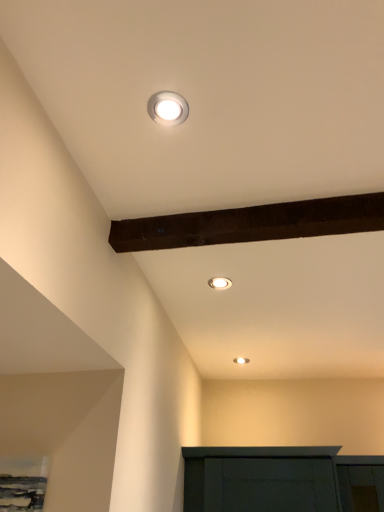
Question: From a real-world perspective, is matte white recessed light at center, arranged as the second lamp when viewed from the top, on white glossy light fixture at upper center, the third lamp viewed from the top?

Choices:
 (A) no
 (B) yes

Answer: (B)

Question: Is matte white recessed light at center, which is the second lamp from back to front, bigger than white glossy light fixture at upper center, the third lamp viewed from the top?

Choices:
 (A) no
 (B) yes

Answer: (A)

Question: Is matte white recessed light at center, placed as the second lamp when sorted from front to back, at the right side of white glossy light fixture at upper center, the third lamp viewed from the top?

Choices:
 (A) no
 (B) yes

Answer: (A)

Question: Does matte white recessed light at center, placed as the second lamp when sorted from front to back, have a smaller size compared to white glossy light fixture at upper center, the third lamp viewed from the top?

Choices:
 (A) no
 (B) yes

Answer: (B)

Question: Is matte white recessed light at center, arranged as the second lamp when viewed from the top, further to the viewer compared to white glossy light fixture at upper center, the 1th lamp positioned from the right?

Choices:
 (A) no
 (B) yes

Answer: (A)

Question: Does point (216, 288) appear closer or farther from the camera than point (243, 364)?

Choices:
 (A) farther
 (B) closer

Answer: (B)

Question: From a real-world perspective, is matte white recessed light at center, arranged as the second lamp when viewed from the top, physically located above or below white glossy light fixture at upper center, which appears as the 1th lamp when ordered from the bottom?

Choices:
 (A) below
 (B) above

Answer: (B)

Question: Choose the correct answer: Is matte white recessed light at center, which is the second lamp from back to front, inside white glossy light fixture at upper center, the 1th lamp positioned from the right, or outside it?

Choices:
 (A) inside
 (B) outside

Answer: (B)

Question: Looking at the image, does matte white recessed light at center, the 2th lamp viewed from the right, seem bigger or smaller compared to white glossy light fixture at upper center, which appears as the 1th lamp when ordered from the bottom?

Choices:
 (A) big
 (B) small

Answer: (B)

Question: Is white glossy light fixture at upper center, the 1th lamp viewed from the back, to the left or to the right of white glossy light fixture at upper center, which is the first lamp in top-to-bottom order, in the image?

Choices:
 (A) right
 (B) left

Answer: (A)

Question: Considering the positions of white glossy light fixture at upper center, the 1th lamp positioned from the right, and white glossy light fixture at upper center, placed as the third lamp when sorted from bottom to top, in the image, is white glossy light fixture at upper center, the 1th lamp positioned from the right, taller or shorter than white glossy light fixture at upper center, placed as the third lamp when sorted from bottom to top,?

Choices:
 (A) tall
 (B) short

Answer: (A)

Question: Looking at their shapes, would you say white glossy light fixture at upper center, which is the 3th lamp in left-to-right order, is wider or thinner than white glossy light fixture at upper center, placed as the third lamp when sorted from bottom to top?

Choices:
 (A) thin
 (B) wide

Answer: (A)

Question: From a real-world perspective, is white glossy light fixture at upper center, the third lamp viewed from the top, positioned above or below white glossy light fixture at upper center, acting as the first lamp starting from the left?

Choices:
 (A) below
 (B) above

Answer: (B)

Question: Is white glossy light fixture at upper center, which appears as the 1th lamp when ordered from the bottom, taller or shorter than matte white recessed light at center, the second lamp viewed from the left?

Choices:
 (A) short
 (B) tall

Answer: (B)

Question: In the image, is white glossy light fixture at upper center, the 1th lamp viewed from the back, on the left side or the right side of matte white recessed light at center, which is the second lamp from back to front?

Choices:
 (A) left
 (B) right

Answer: (B)